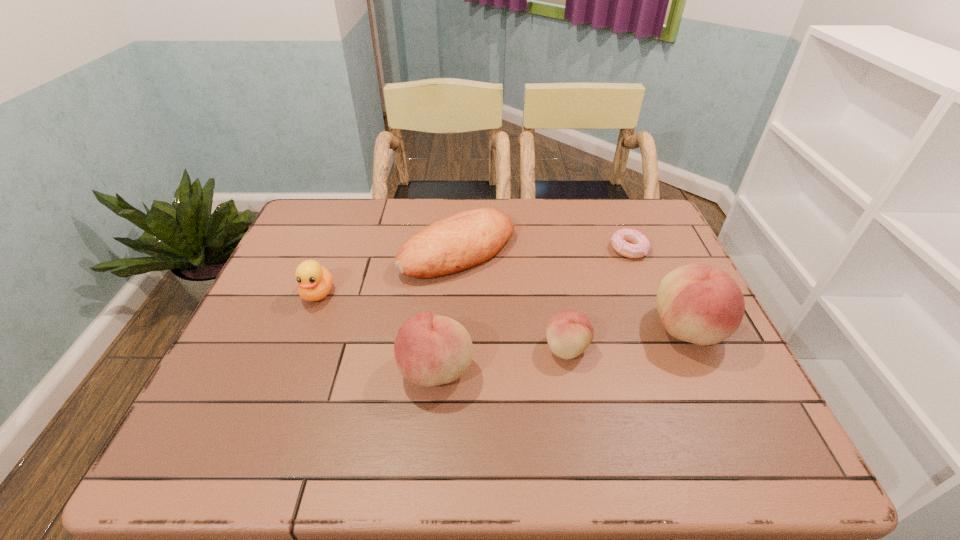
You are a GUI agent. You are given a task and a screenshot of the screen. Output one action in this format:
    pyautogui.click(x=<x>, y=<y>)
    Task: Click on the vacant region located 0.290m on the back of the rightmost peach
    The height and width of the screenshot is (540, 960).
    Given the screenshot: What is the action you would take?
    [643, 234]

Where is `free space located 0.350m on the front of the bread`? This screenshot has width=960, height=540. free space located 0.350m on the front of the bread is located at coordinates (449, 399).

I want to click on vacant space located on the right of the doughnut, so click(x=667, y=249).

What are the coordinates of `free point located on the face of the duckling` in the screenshot? It's located at (285, 379).

You are a GUI agent. You are given a task and a screenshot of the screen. Output one action in this format:
    pyautogui.click(x=<x>, y=<y>)
    Task: Click on the bread situated at the far edge
    The width and height of the screenshot is (960, 540).
    Given the screenshot: What is the action you would take?
    pyautogui.click(x=463, y=240)

Where is `doughnut that is at the far edge`? This screenshot has height=540, width=960. doughnut that is at the far edge is located at coordinates (630, 243).

Identify the location of object present at the near edge. (430, 350).

At what (x,y) coordinates should I click in order to perform the action: click on object at the left edge. Please return your answer as a coordinate pair (x, y). Image resolution: width=960 pixels, height=540 pixels. Looking at the image, I should click on (315, 281).

Find the location of `peach present at the right edge`. peach present at the right edge is located at coordinates (701, 304).

Identify the location of doughnut present at the right edge. The image size is (960, 540). (630, 243).